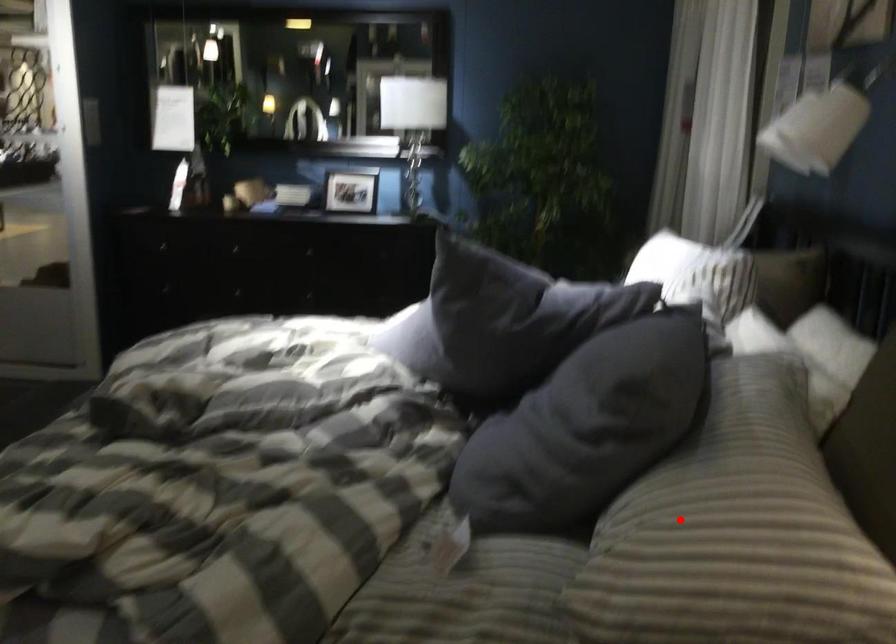
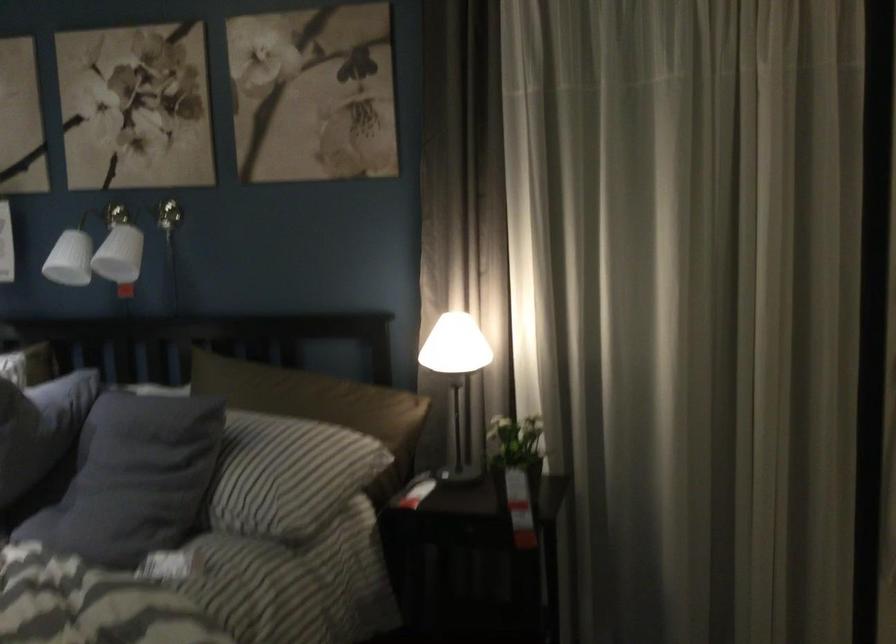
Locate, in the second image, the point that corresponds to the highlighted location in the first image.

(280, 471)